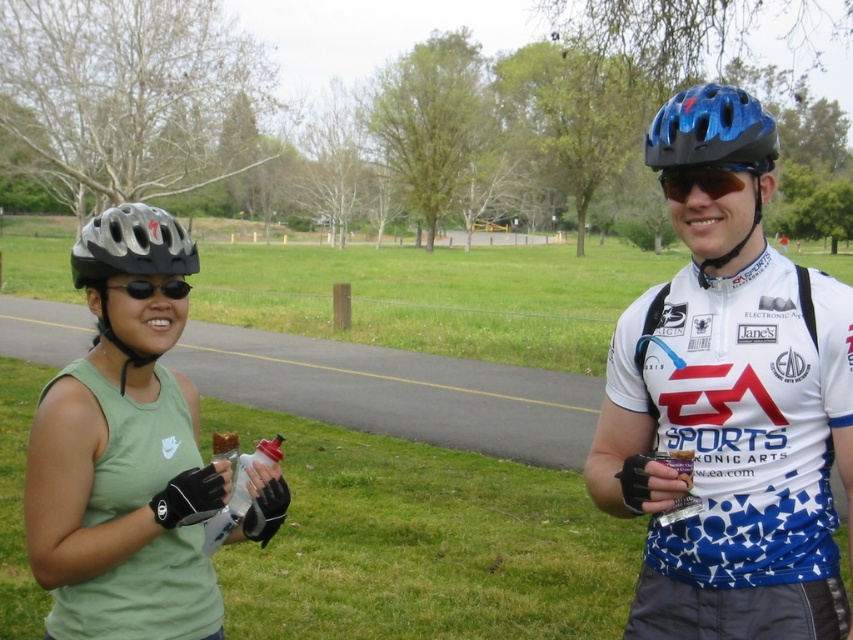
Who is more forward, [136,204] or [167,282]?

Point [167,282] is in front.

Can you confirm if green matte helmet at left is positioned below black matte sunglasses at left?

Correct, green matte helmet at left is located below black matte sunglasses at left.

Is point (184, 442) farther from camera compared to point (161, 282)?

Yes, point (184, 442) is behind point (161, 282).

You are a GUI agent. You are given a task and a screenshot of the screen. Output one action in this format:
    pyautogui.click(x=<x>, y=<y>)
    Task: Click on the green matte helmet at left
    The height and width of the screenshot is (640, 853).
    Given the screenshot: What is the action you would take?
    pyautogui.click(x=125, y=452)

Consider the image. Between silver/metallic helmet at left and sunglasses at center, which one has less height?

silver/metallic helmet at left is shorter.

Is point (79, 237) positioned in front of point (665, 170)?

No.

At what (x,y) coordinates should I click in order to perform the action: click on silver/metallic helmet at left. Please return your answer as a coordinate pair (x, y). Looking at the image, I should click on point(131,244).

Which is more to the left, green matte helmet at left or blue matte helmet at upper center?

green matte helmet at left is more to the left.

Looking at this image, does green matte helmet at left have a lesser width compared to blue matte helmet at upper center?

Yes.

The height and width of the screenshot is (640, 853). Describe the element at coordinates (125, 452) in the screenshot. I see `green matte helmet at left` at that location.

The height and width of the screenshot is (640, 853). In order to click on green matte helmet at left in this screenshot , I will do `click(125, 452)`.